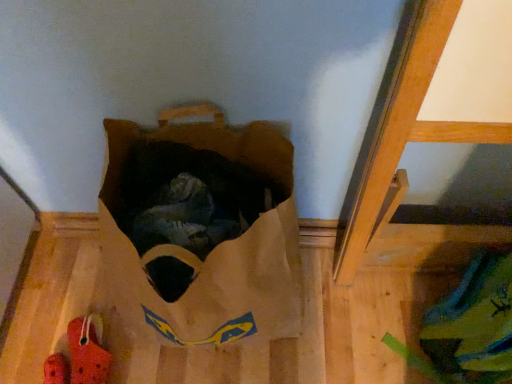
Identify the location of vacant area situated to the left side of rubber/crocodile at lower left. The image size is (512, 384). (33, 336).